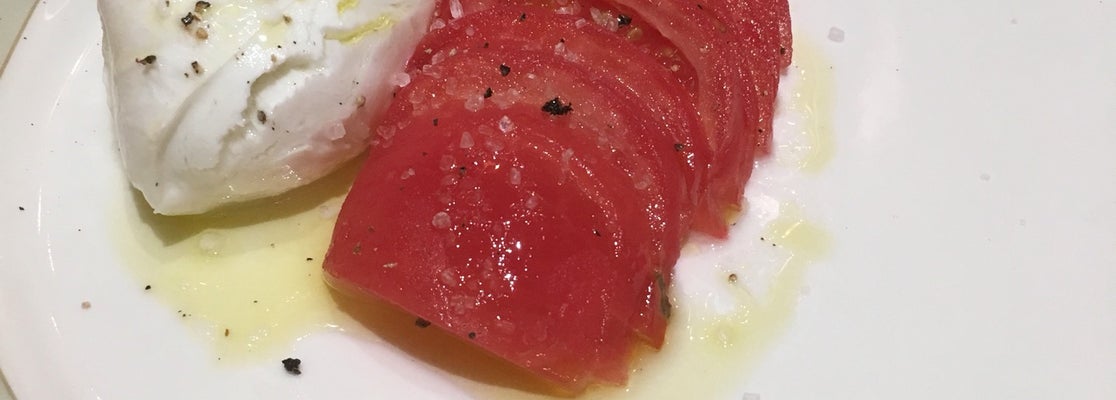
The image size is (1116, 400). Identify the location of plate. (1010, 62).